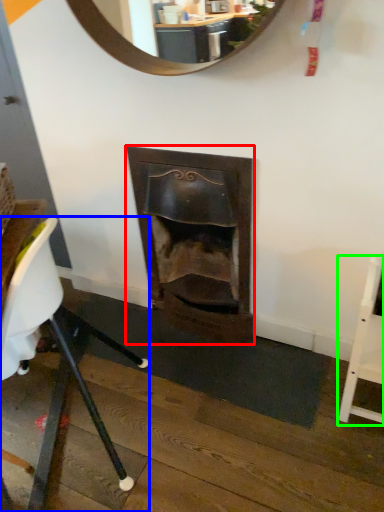
Question: Which object is the closest to the fireplace (highlighted by a red box)? Choose among these: chair (highlighted by a blue box) or chair (highlighted by a green box).

Choices:
 (A) chair
 (B) chair

Answer: (A)